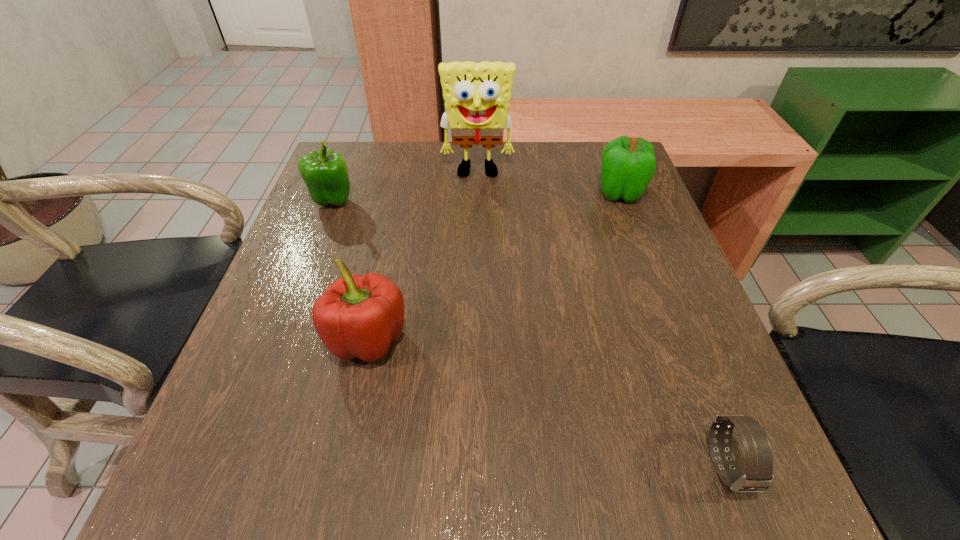
Locate an element on the screen. The image size is (960, 540). the tallest object is located at coordinates (477, 96).

Where is `the third object from left to right`? The height and width of the screenshot is (540, 960). the third object from left to right is located at coordinates (477, 96).

The image size is (960, 540). Find the location of `the leftmost bell pepper`. the leftmost bell pepper is located at coordinates (325, 173).

Find the location of a particular element. the rightmost bell pepper is located at coordinates (628, 164).

This screenshot has height=540, width=960. I want to click on the nearest bell pepper, so click(x=358, y=316).

You are a GUI agent. You are given a task and a screenshot of the screen. Output one action in this format:
    pyautogui.click(x=<x>, y=<y>)
    Task: Click on the second bell pepper from right to left
    
    Given the screenshot: What is the action you would take?
    pyautogui.click(x=358, y=316)

Where is `watch`? watch is located at coordinates (758, 477).

Where is `the nearest object`? the nearest object is located at coordinates (758, 477).

I want to click on free space located 0.140m on the face of the tallest object, so click(477, 218).

Identify the location of vacant space located on the front of the leftmost bell pepper. The image size is (960, 540). (289, 314).